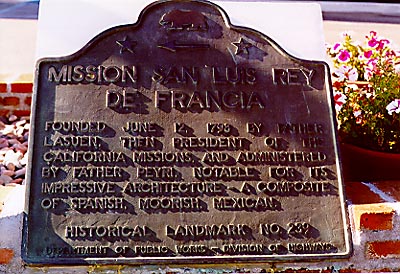
Locate an element on the screen. pot is located at coordinates (357, 164).